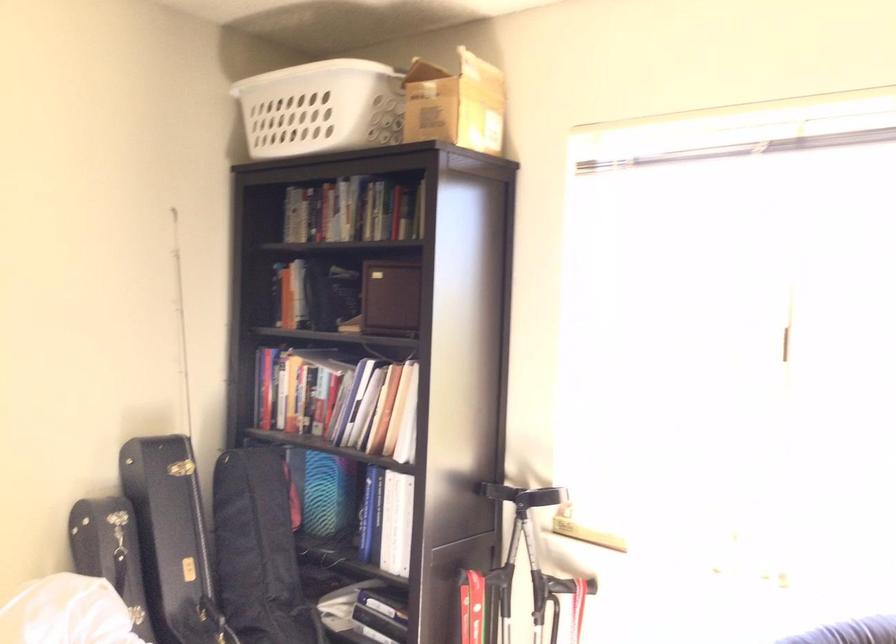
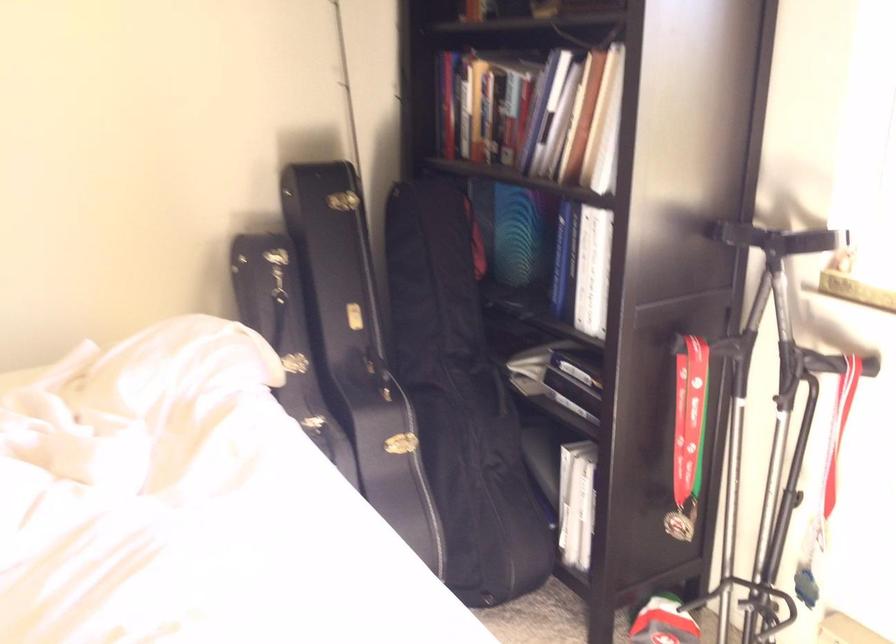
Consider the image. First-person continuous shooting, in which direction is the camera rotating?

The camera rotated toward left-down.